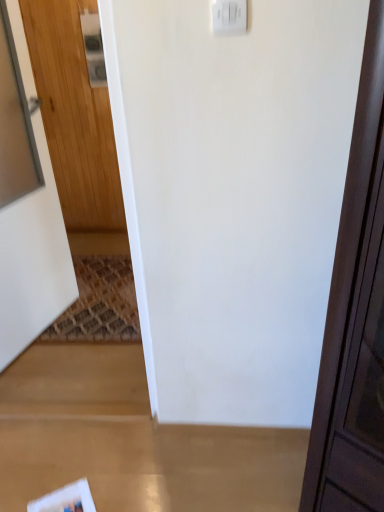
Question: Is point (29, 509) closer or farther from the camera than point (54, 313)?

Choices:
 (A) farther
 (B) closer

Answer: (B)

Question: Considering the relative positions of white glossy magazine at lower left and wooden door at left in the image provided, is white glossy magazine at lower left to the left or to the right of wooden door at left?

Choices:
 (A) right
 (B) left

Answer: (A)

Question: Which of these objects is positioned farthest from the wooden door at left?

Choices:
 (A) white plastic light switch at upper center, the second light switch from the left
 (B) white glossy magazine at lower left
 (C) white plastic light switch at upper center, which is the 2th light switch from front to back

Answer: (A)

Question: Estimate the real-world distances between objects in this image. Which object is closer to the wooden door at left?

Choices:
 (A) white glossy magazine at lower left
 (B) white plastic light switch at upper center, which appears as the 2th light switch when ordered from the bottom
 (C) white plastic light switch at upper center, the 2th light switch in the back-to-front sequence

Answer: (A)